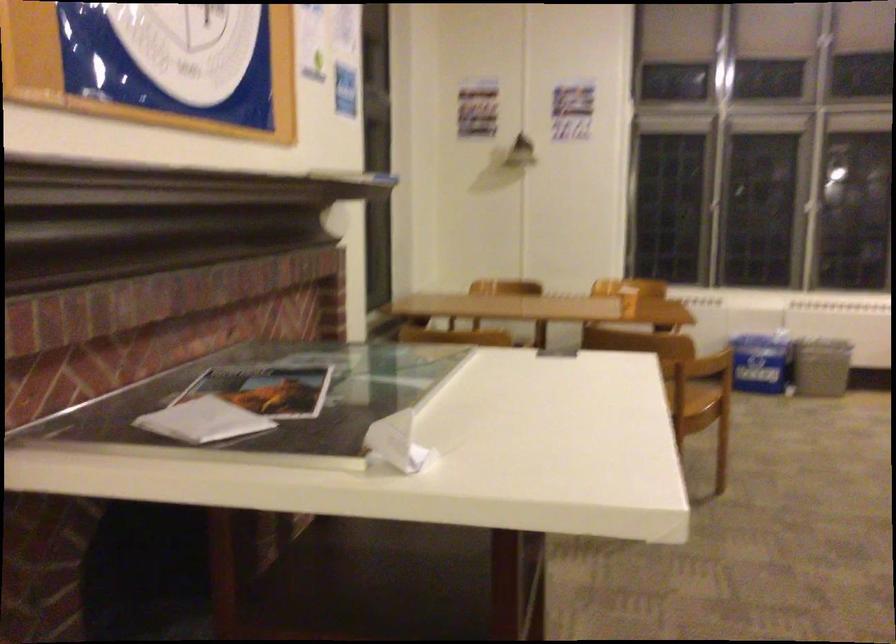
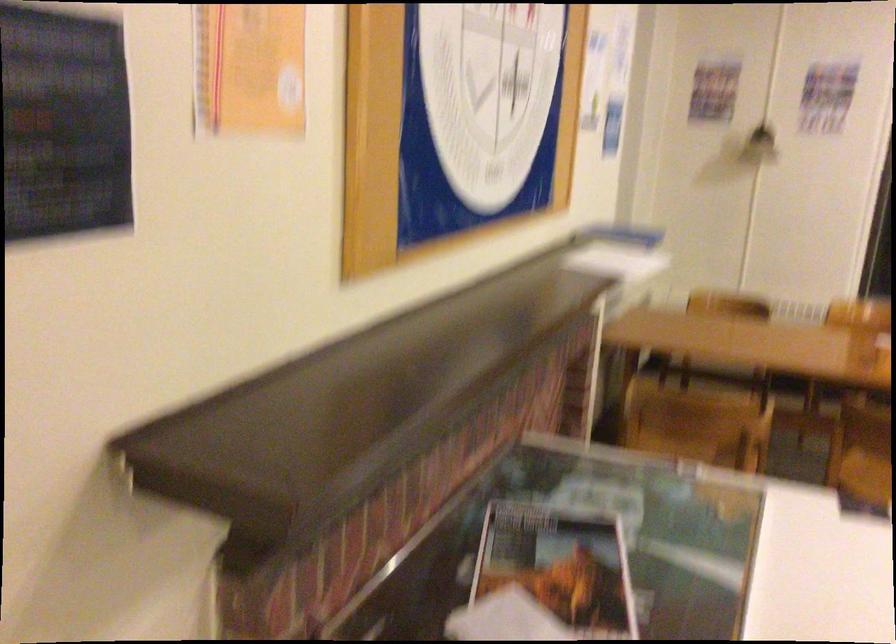
In the second image, find the point that corresponds to the point at 254,391 in the first image.

(560, 565)